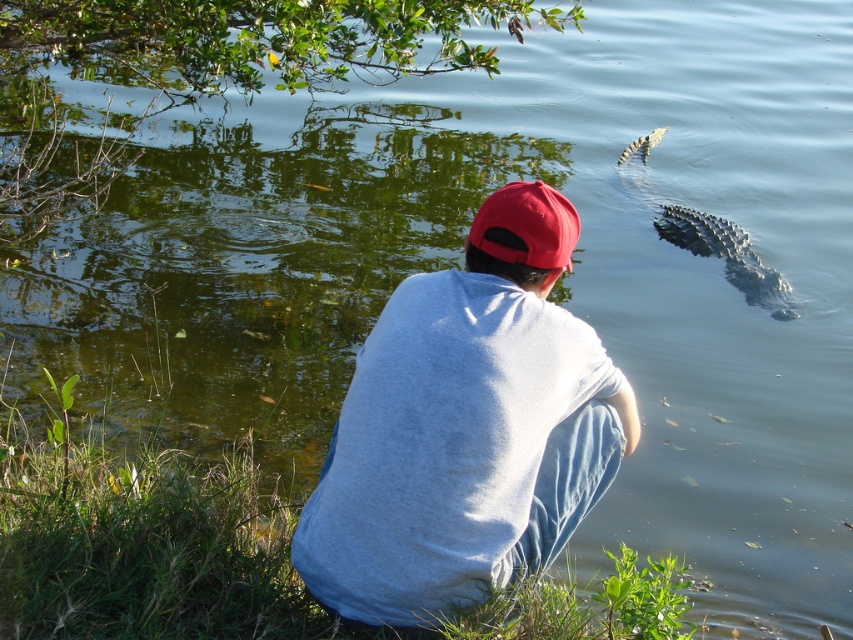
You are a photographer trying to capture a clear shot of the gray cotton shirt at center and the matte red cap at center. Since you want both subjects in focus, which one should you adjust your camera focus on first to ensure the closest object is sharp?

The gray cotton shirt at center is closer to the viewer than the matte red cap at center, so you should focus on the gray cotton shirt at center first to ensure the closest object is sharp.

You are a photographer trying to capture both the gray cotton shirt at center and the gray scaly crocodile at upper right in a single frame. Based on their sizes, which object should you zoom in on to ensure both fit in the shot?

The gray cotton shirt at center is wider than the gray scaly crocodile at upper right, so you should zoom out to include both objects in the frame.

You are standing at the center of the image and want to locate the gray scaly crocodile at upper right. In which direction should you look?

The gray scaly crocodile at upper right is located at the upper right direction from the center of the image.